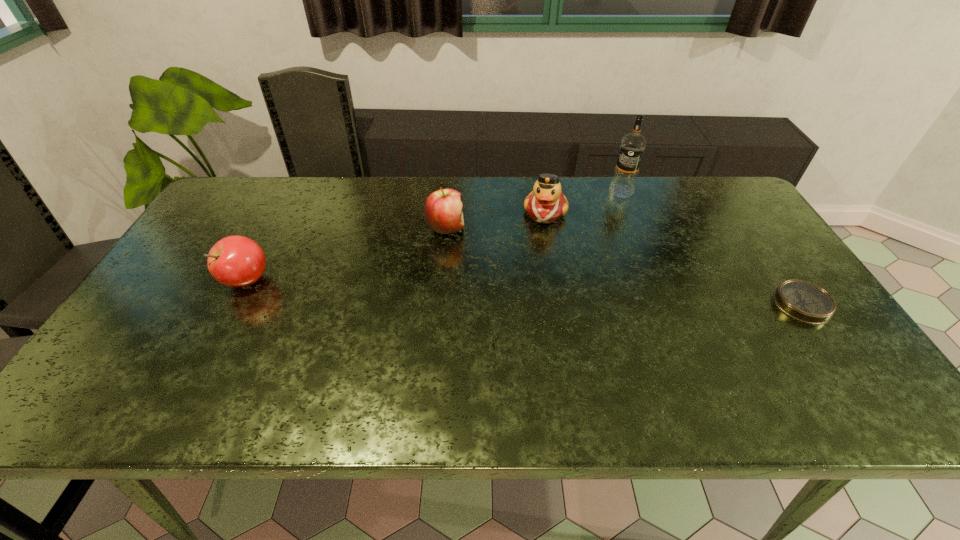
Where is `the second closest object relative to the vodka`? The image size is (960, 540). the second closest object relative to the vodka is located at coordinates (804, 301).

The image size is (960, 540). Find the location of `object that stands as the closest to the vodka`. object that stands as the closest to the vodka is located at coordinates (546, 203).

The height and width of the screenshot is (540, 960). In order to click on blank area in the image that satisfies the following two spatial constraints: 1. on the front side of the compass; 2. on the right side of the vodka in this screenshot , I will do `click(665, 304)`.

The width and height of the screenshot is (960, 540). I want to click on free spot that satisfies the following two spatial constraints: 1. on the back side of the third object from left to right; 2. on the left side of the second object from left to right, so click(446, 212).